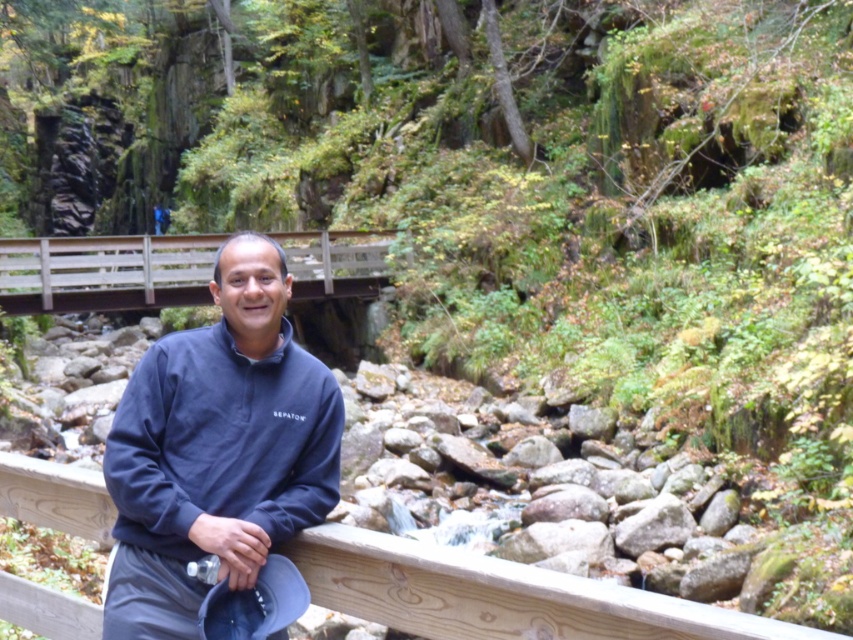
Does navy fleece sweater at center appear on the left side of wooden bridge at center?

In fact, navy fleece sweater at center is to the right of wooden bridge at center.

Is point (171, 582) positioned before point (294, 285)?

Yes.

Is point (265, 420) positioned behind point (132, 272)?

That is False.

Locate an element on the screen. This screenshot has width=853, height=640. navy fleece sweater at center is located at coordinates (218, 449).

Based on the photo, can you confirm if wooden rail at center is wider than wooden bridge at center?

No, wooden rail at center is not wider than wooden bridge at center.

Based on the photo, does wooden rail at center have a lesser height compared to wooden bridge at center?

Indeed, wooden rail at center has a lesser height compared to wooden bridge at center.

Between point (744, 616) and point (13, 248), which one is positioned in front?

Point (744, 616) is more forward.

I want to click on wooden rail at center, so click(500, 595).

Is point (131, 531) farther from camera compared to point (693, 632)?

Yes, it is behind point (693, 632).

Is point (112, 628) more distant than point (763, 620)?

Yes, it is.

Identify the location of navy fleece sweater at center. The height and width of the screenshot is (640, 853). (218, 449).